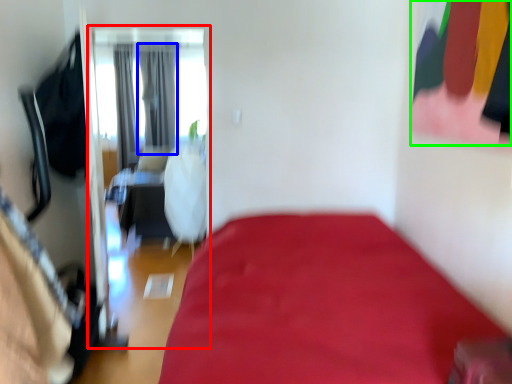
Question: Which object is positioned farthest from screen door (highlighted by a red box)? Select from curtain (highlighted by a blue box) and clothing (highlighted by a green box).

Choices:
 (A) curtain
 (B) clothing

Answer: (B)